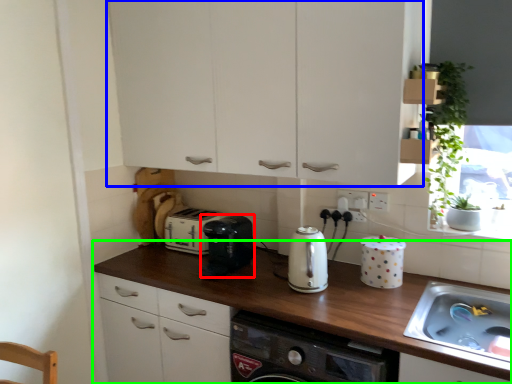
Question: Estimate the real-world distances between objects in this image. Which object is farther from kitchen appliance (highlighted by a red box), cabinetry (highlighted by a blue box) or countertop (highlighted by a green box)?

Choices:
 (A) cabinetry
 (B) countertop

Answer: (A)